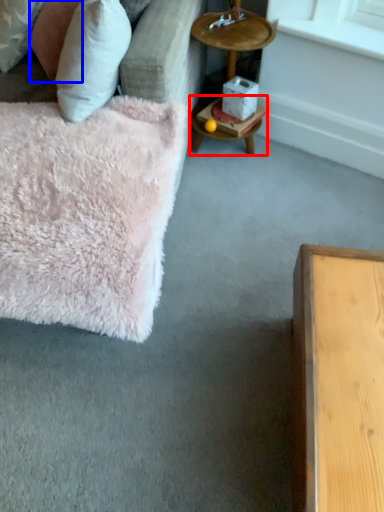
Question: Which object is closer to the camera taking this photo, table (highlighted by a red box) or pillow (highlighted by a blue box)?

Choices:
 (A) table
 (B) pillow

Answer: (B)